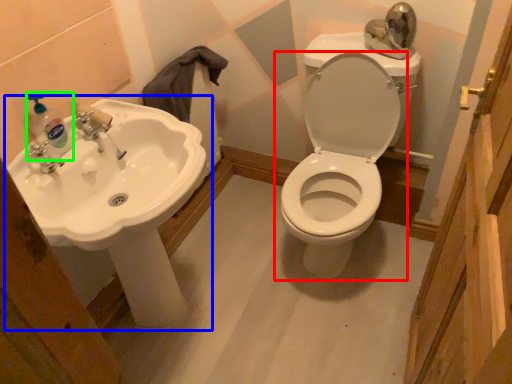
Question: Which is nearer to the toilet (highlighted by a red box)? sink (highlighted by a blue box) or soap dispenser (highlighted by a green box).

Choices:
 (A) sink
 (B) soap dispenser

Answer: (A)